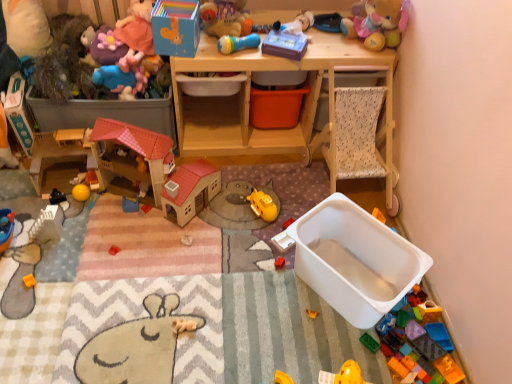
Where is `unoccupied space behind blue plastic toy at center, which ranks as the 8th toy in right-to-left order`? The width and height of the screenshot is (512, 384). unoccupied space behind blue plastic toy at center, which ranks as the 8th toy in right-to-left order is located at coordinates point(126,192).